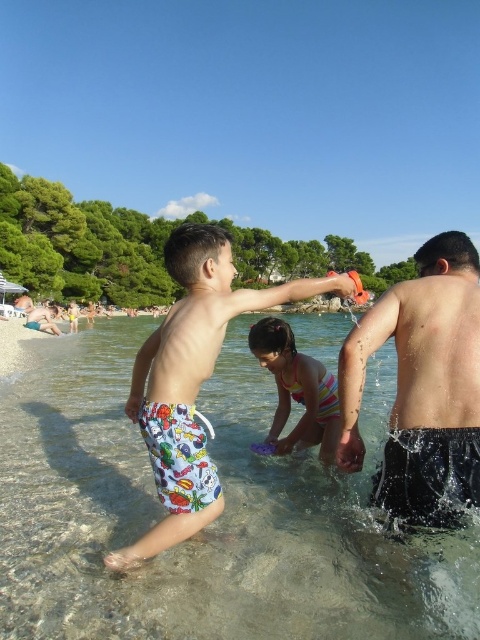
You are standing on the beach and want to walk to the clear water at center. Based on the coordinates provided in the Objects Description, in which general direction should you head from your current position?

The clear water at center is located at coordinates point (212, 524). Since the x and y coordinates are both greater than 0.5, you should head towards the upper right direction from your current position to reach the clear water at center.

You are a photographer standing at the beach scene. You want to take a photo that includes both the point at coordinates point (20, 410) and point (328, 397). Since you want to ensure both points are in focus, which point should you focus on first to make sure the other is also sharp?

You should focus on point (20, 410) first because it is closer to you than point (328, 397), so focusing on the closer point will ensure the farther point is also in focus.

You are a photographer positioned on the beach and want to take a photo that includes both the dark gray shorts at right and the printed swim trunks at center. Which object should you focus on first to ensure both are in sharp focus?

You should focus on the dark gray shorts at right first because it is closer to the viewer than the printed swim trunks at center, so focusing on the closer object will help ensure both are in focus.